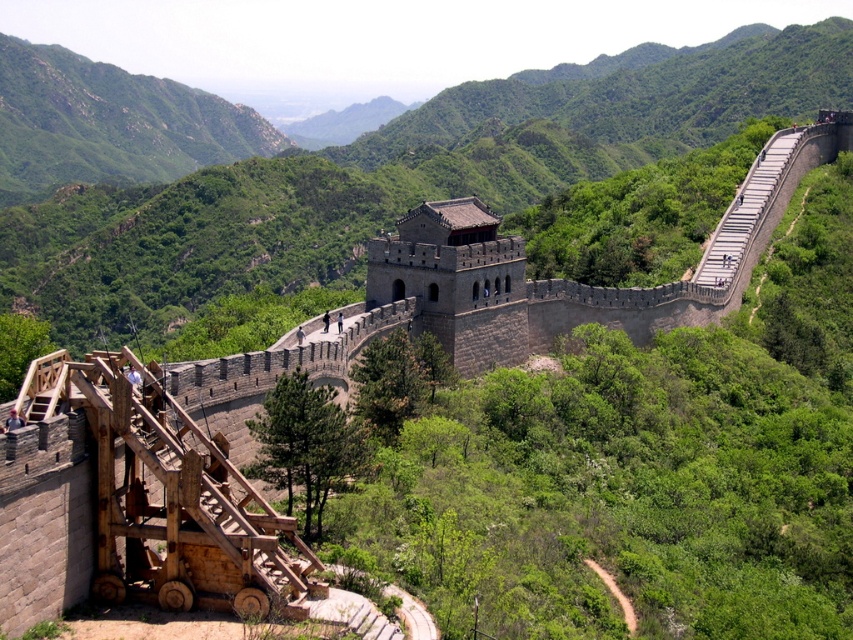
Is point (154, 426) farther from camera compared to point (776, 164)?

No.

Between wooden staircase at lower left and gray stone staircase at upper right, which one has more height?

gray stone staircase at upper right is taller.

Image resolution: width=853 pixels, height=640 pixels. What do you see at coordinates (193, 513) in the screenshot?
I see `wooden staircase at lower left` at bounding box center [193, 513].

The image size is (853, 640). Identify the location of wooden staircase at lower left. point(193,513).